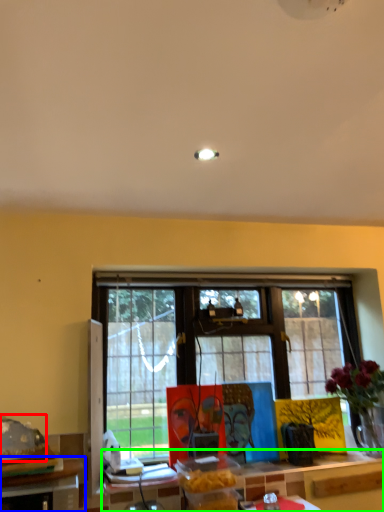
Question: Estimate the real-world distances between objects in this image. Which object is farther from food (highlighted by a red box), table (highlighted by a blue box) or table (highlighted by a green box)?

Choices:
 (A) table
 (B) table

Answer: (B)